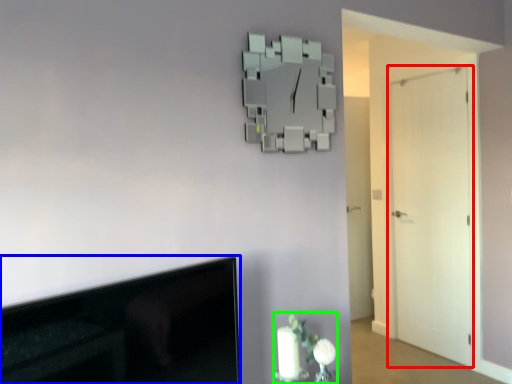
Question: Based on their relative distances, which object is farther from door (highlighted by a red box)? Choose from television (highlighted by a blue box) and floral arrangement (highlighted by a green box).

Choices:
 (A) television
 (B) floral arrangement

Answer: (A)